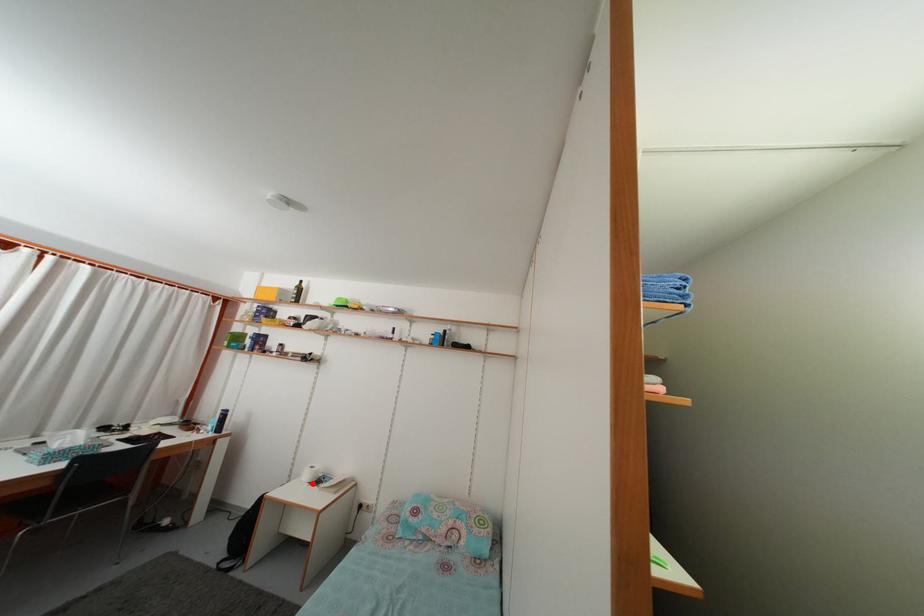
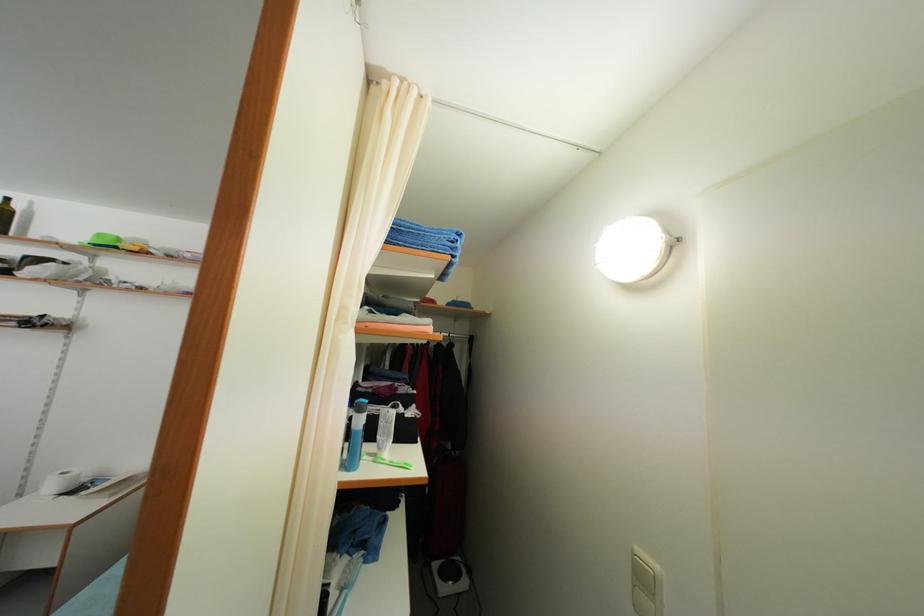
Question: I am providing you with two images of the same scene from different viewpoints. A red point is shown in image1. For the corresponding object point in image2, is it positioned nearer or farther from the camera?

Choices:
 (A) Nearer
 (B) Farther

Answer: (A)